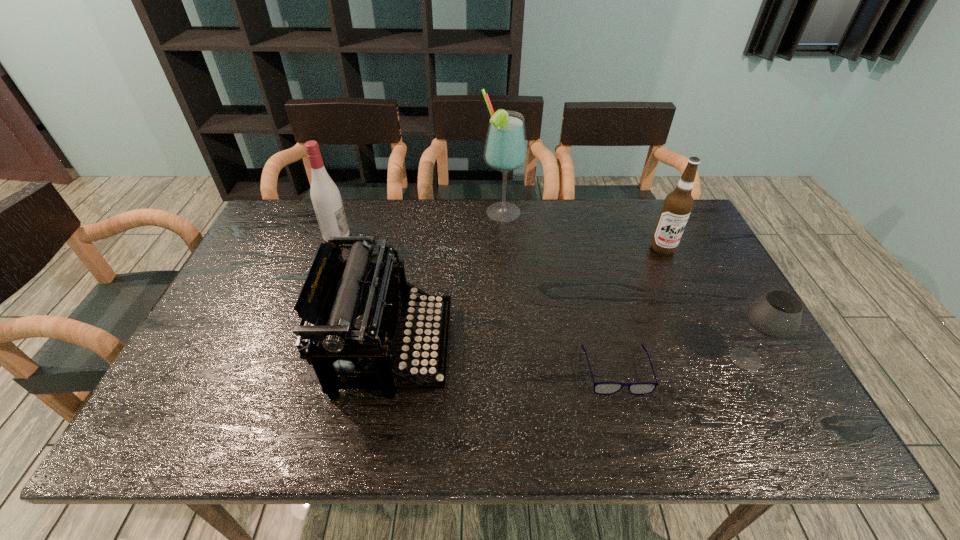
At what (x,y) coordinates should I click in order to perform the action: click on the tallest alcohol. Please return your answer as a coordinate pair (x, y). This screenshot has width=960, height=540. Looking at the image, I should click on (506, 150).

Locate an element on the screen. The image size is (960, 540). the second alcohol from left to right is located at coordinates (506, 150).

Locate an element on the screen. the leftmost alcohol is located at coordinates (325, 196).

This screenshot has height=540, width=960. Find the location of `the rightmost alcohol`. the rightmost alcohol is located at coordinates (678, 204).

The image size is (960, 540). I want to click on typewriter, so click(354, 306).

Locate an element on the screen. The image size is (960, 540). the second object from left to right is located at coordinates (354, 306).

The width and height of the screenshot is (960, 540). Find the location of `wineglass`. wineglass is located at coordinates (777, 314).

This screenshot has height=540, width=960. I want to click on spectacles, so click(x=603, y=388).

This screenshot has height=540, width=960. I want to click on the shortest object, so click(603, 388).

Where is `vacant point located on the left of the third object from left to right`? The height and width of the screenshot is (540, 960). vacant point located on the left of the third object from left to right is located at coordinates (417, 213).